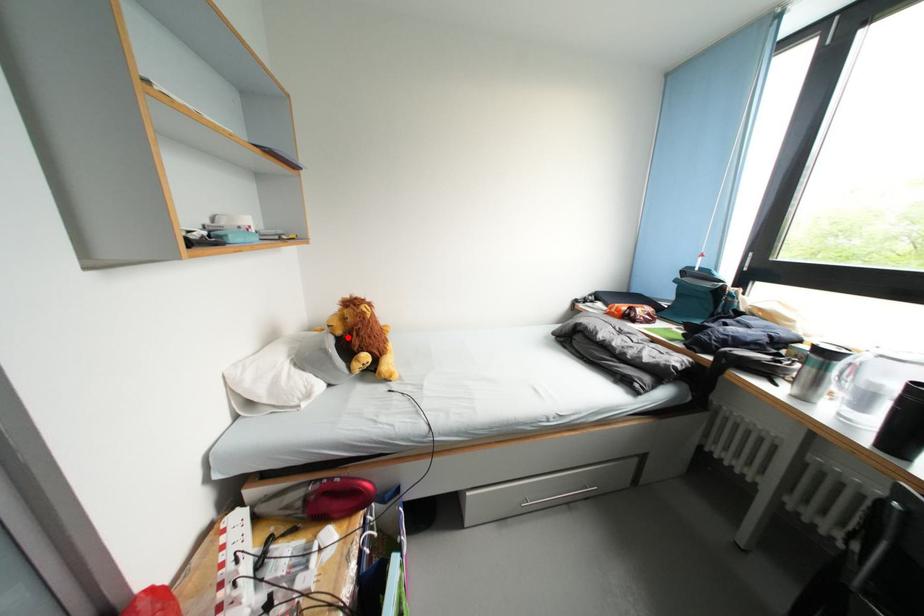
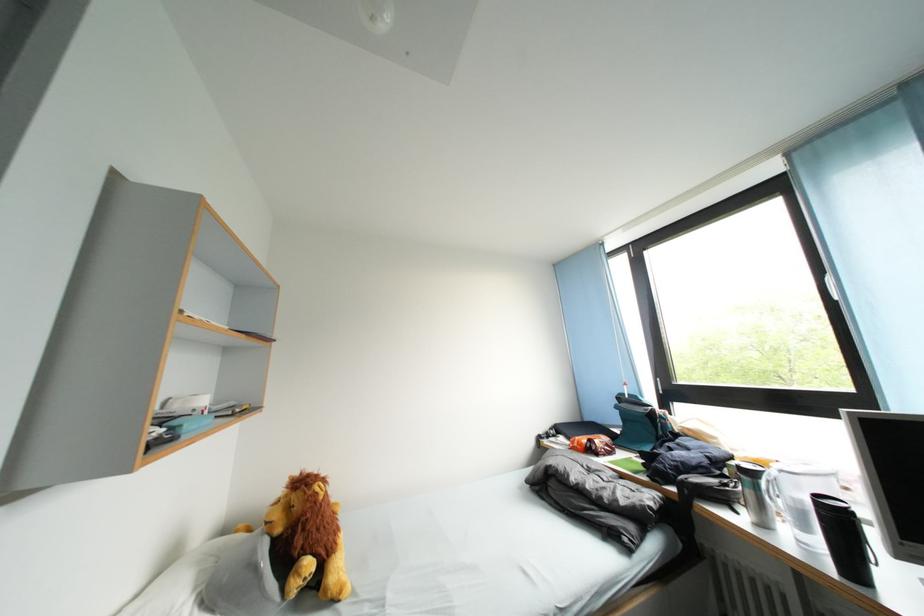
In the second image, find the point that corresponds to the highlighted location in the first image.

(287, 535)